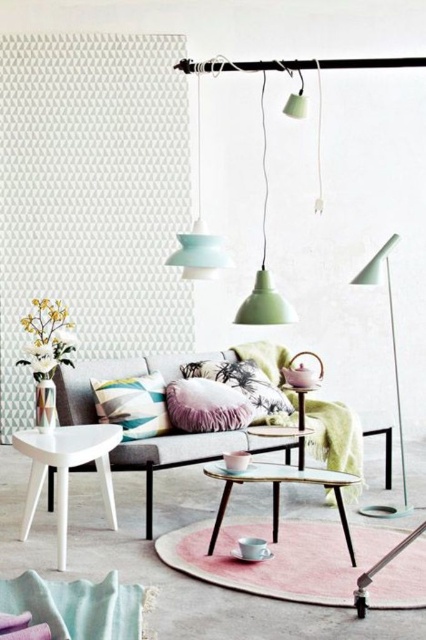
Question: Which point is farther from the camera taking this photo?

Choices:
 (A) (x=216, y=468)
 (B) (x=290, y=97)
 (C) (x=91, y=371)

Answer: (C)

Question: Does velvet purple pillow at center appear under metallic glass coffee table at center?

Choices:
 (A) yes
 (B) no

Answer: (B)

Question: Is velvet purple pillow at center thinner than fluffy pink pillow at center?

Choices:
 (A) no
 (B) yes

Answer: (B)

Question: Which point is farther from the camera taking this photo?

Choices:
 (A) (x=276, y=525)
 (B) (x=296, y=116)
 (C) (x=253, y=376)

Answer: (C)

Question: Can you confirm if striped fabric pillow at center is thinner than fluffy pink pillow at center?

Choices:
 (A) yes
 (B) no

Answer: (A)

Question: Among these points, which one is farthest from the camera?

Choices:
 (A) (106, 483)
 (B) (106, 412)
 (C) (170, 433)

Answer: (C)